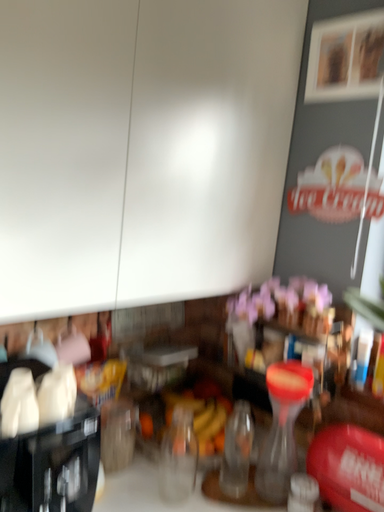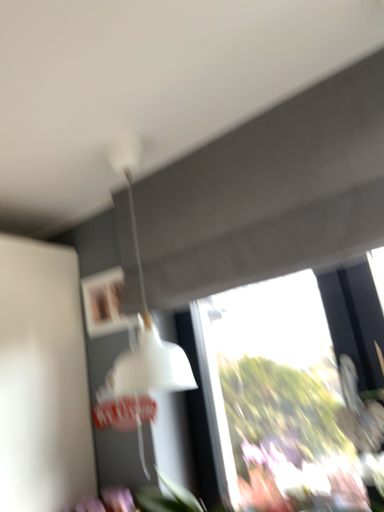
Question: How did the camera likely rotate when shooting the video?

Choices:
 (A) rotated left
 (B) rotated right

Answer: (B)